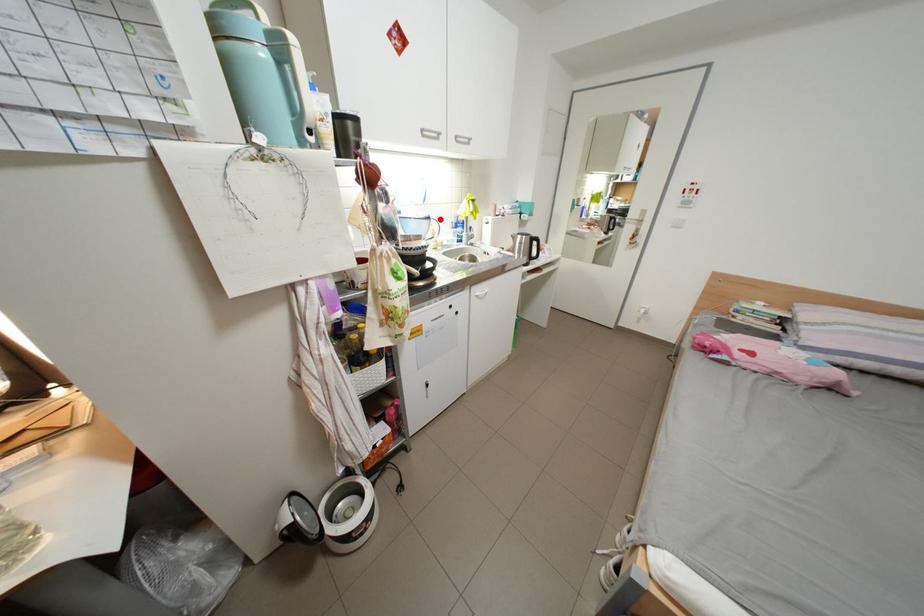
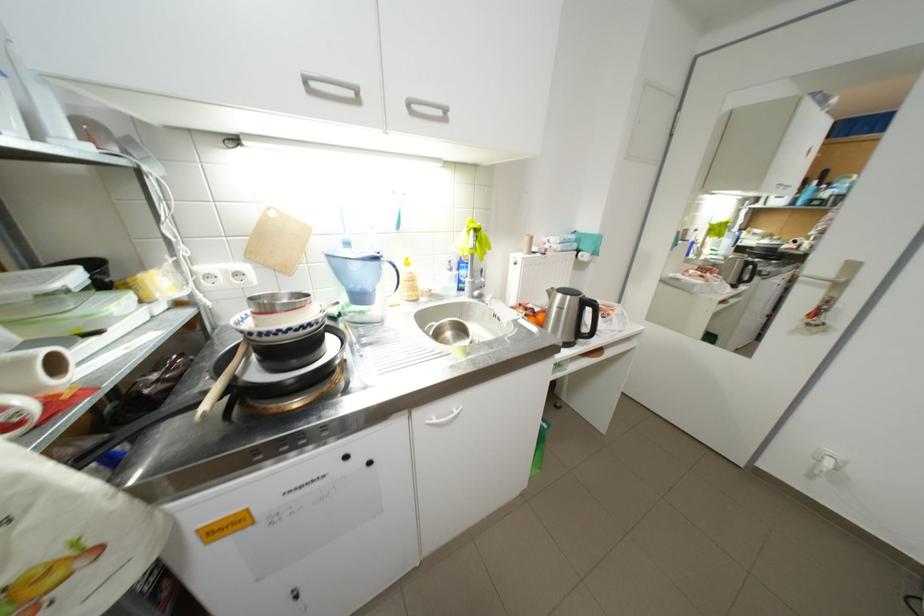
Find the pixel in the second image that matches the highlighted location in the first image.

(387, 259)